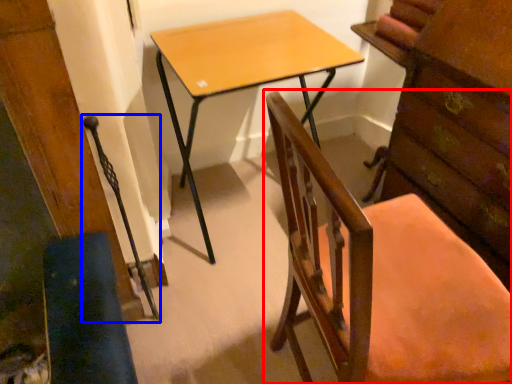
Question: Which of the following is the farthest to the observer, chair (highlighted by a red box) or swivel chair (highlighted by a blue box)?

Choices:
 (A) chair
 (B) swivel chair

Answer: (B)